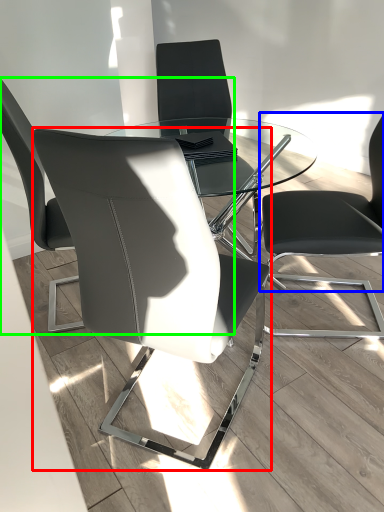
Question: Based on their relative distances, which object is nearer to chair (highlighted by a red box)? Choose from chair (highlighted by a blue box) and chair (highlighted by a green box).

Choices:
 (A) chair
 (B) chair

Answer: (B)